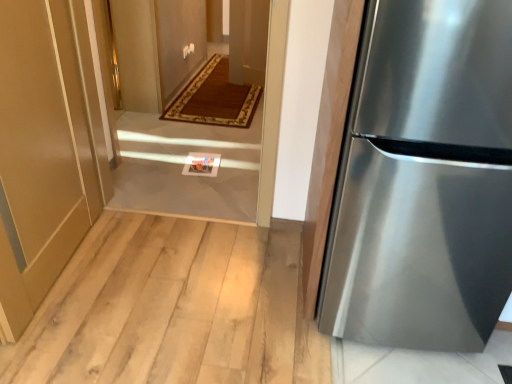
Question: From the image's perspective, relative to stainless steel refrigerator at right, is white tile floor at center above or below?

Choices:
 (A) below
 (B) above

Answer: (B)

Question: From a real-world perspective, is white tile floor at center above or below stainless steel refrigerator at right?

Choices:
 (A) below
 (B) above

Answer: (A)

Question: Estimate the real-world distances between objects in this image. Which object is farther from the matte gold door at lower left?

Choices:
 (A) white tile floor at center
 (B) stainless steel refrigerator at right

Answer: (B)

Question: Which of these objects is positioned closest to the white tile floor at center?

Choices:
 (A) matte gold door at lower left
 (B) stainless steel refrigerator at right

Answer: (A)